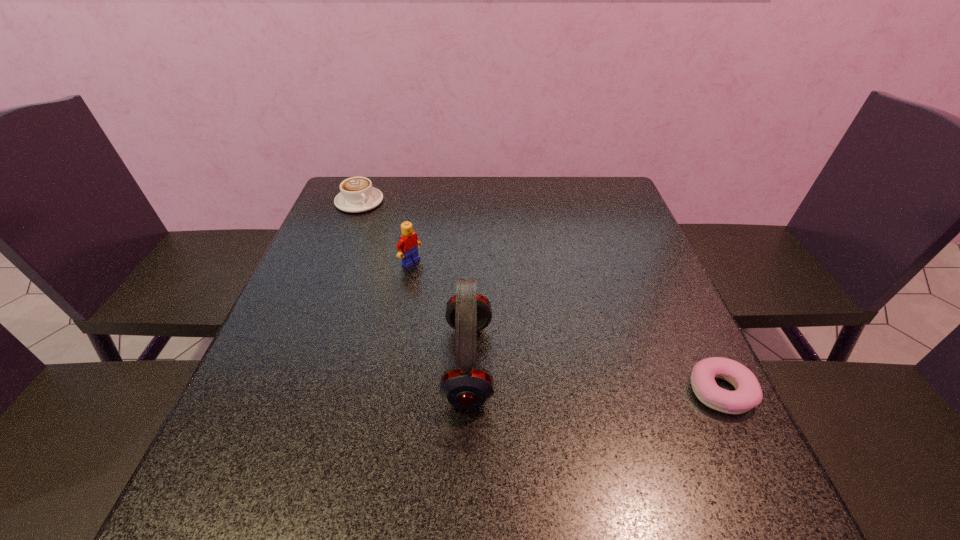
Locate an element on the screen. vacant spot on the desktop that is between the earphone and the shortest object and is positioned with the handle on the right side of the leftmost object is located at coordinates (570, 375).

At what (x,y) coordinates should I click in order to perform the action: click on vacant space on the desktop that is between the earphone and the rightmost object and is positioned on the face of the Lego. Please return your answer as a coordinate pair (x, y). The width and height of the screenshot is (960, 540). Looking at the image, I should click on (612, 380).